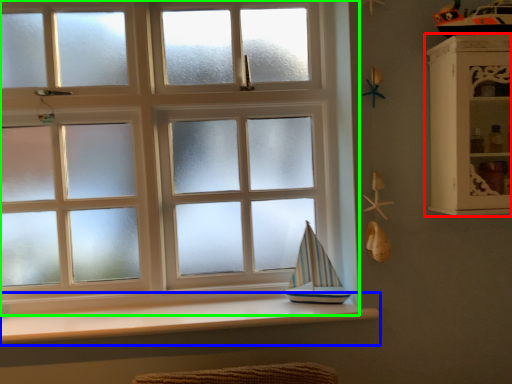
Question: Which is farther away from shelf (highlighted by a red box)? window sill (highlighted by a blue box) or window (highlighted by a green box)?

Choices:
 (A) window sill
 (B) window

Answer: (B)